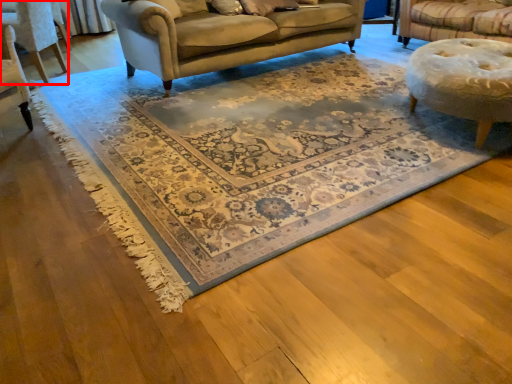
Question: Considering the relative positions of chair (annotated by the red box) and mat in the image provided, where is chair (annotated by the red box) located with respect to the staircase?

Choices:
 (A) left
 (B) right

Answer: (A)